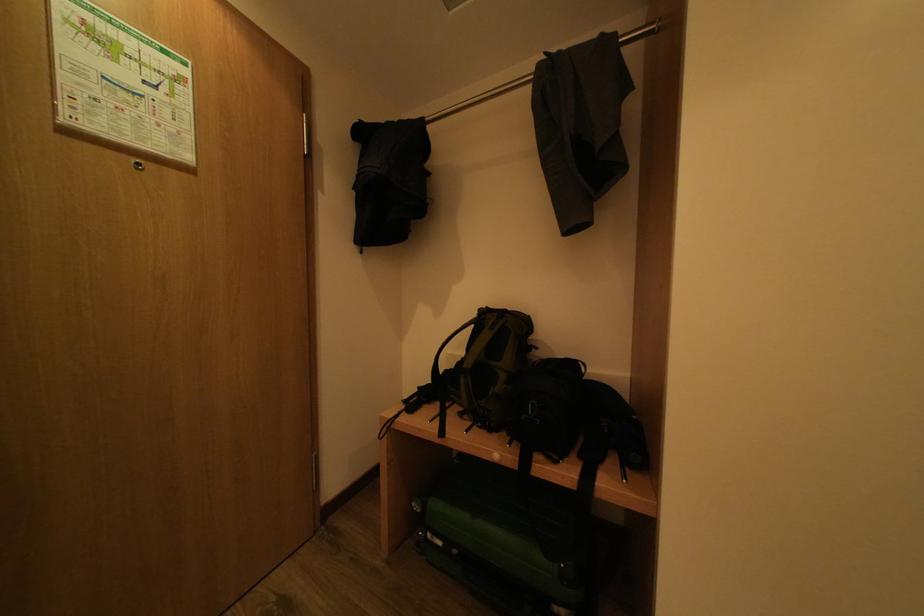
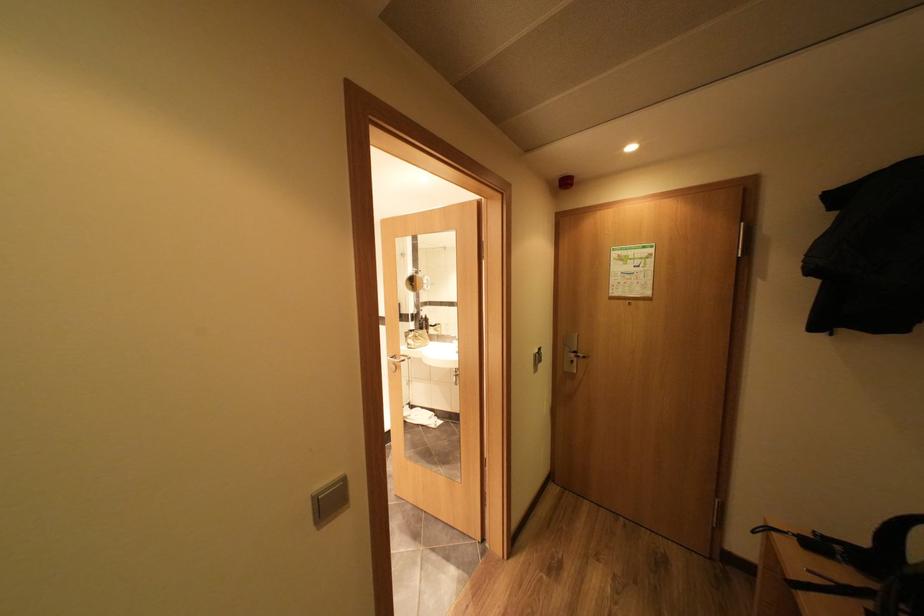
Locate, in the second image, the point that corresponds to [101,148] in the first image.

(626, 302)